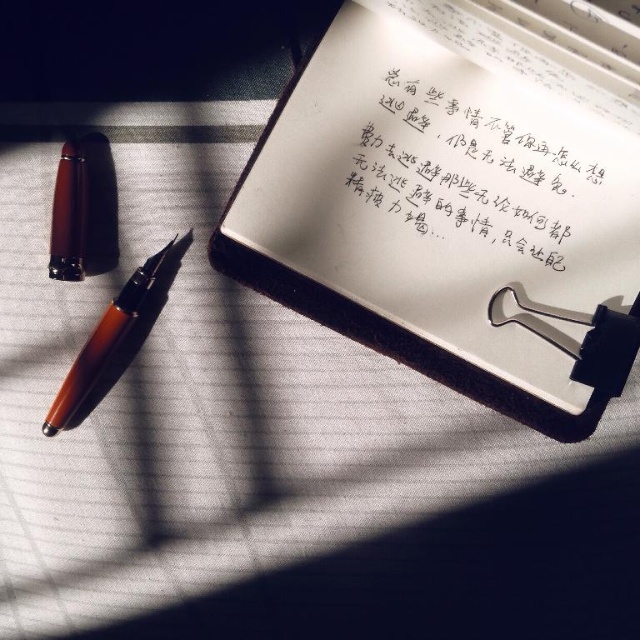
Does white paper notebook at upper center lie behind brown polished wood pencil at left?

No, white paper notebook at upper center is closer to the viewer.

The height and width of the screenshot is (640, 640). I want to click on white paper notebook at upper center, so click(x=460, y=198).

Is point (333, 260) closer to camera compared to point (64, 220)?

No, it is not.

At what (x,y) coordinates should I click in order to perform the action: click on white paper notebook at upper center. Please return your answer as a coordinate pair (x, y). This screenshot has height=640, width=640. Looking at the image, I should click on (460, 198).

Where is `white paper notebook at upper center`? white paper notebook at upper center is located at coordinates (460, 198).

Locate an element on the screen. white paper notebook at upper center is located at coordinates (460, 198).

Who is more distant from viewer, [80,358] or [81,262]?

Positioned behind is point [81,262].

Who is higher up, translucent amber pen at center-left or brown polished wood pencil at left?

Positioned higher is brown polished wood pencil at left.

Image resolution: width=640 pixels, height=640 pixels. In order to click on translucent amber pen at center-left in this screenshot , I will do `click(104, 340)`.

Where is `translucent amber pen at center-left`? translucent amber pen at center-left is located at coordinates (104, 340).